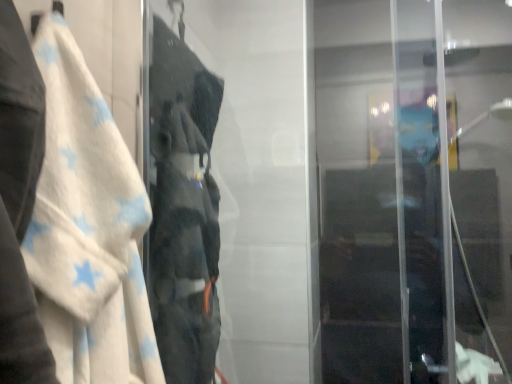
Question: Should I look upward or downward to see white soft towel at left?

Choices:
 (A) up
 (B) down

Answer: (B)